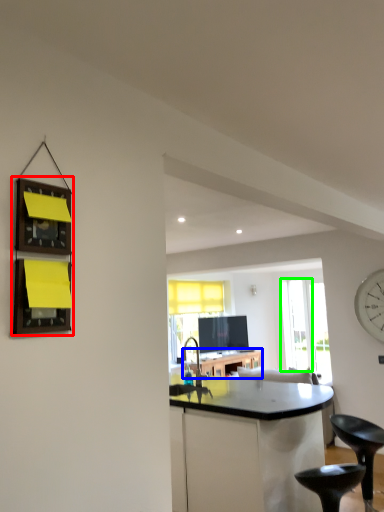
Question: Estimate the real-world distances between objects in this image. Which object is closer to shelf (highlighted by a red box), table (highlighted by a blue box) or glass door (highlighted by a green box)?

Choices:
 (A) table
 (B) glass door

Answer: (A)